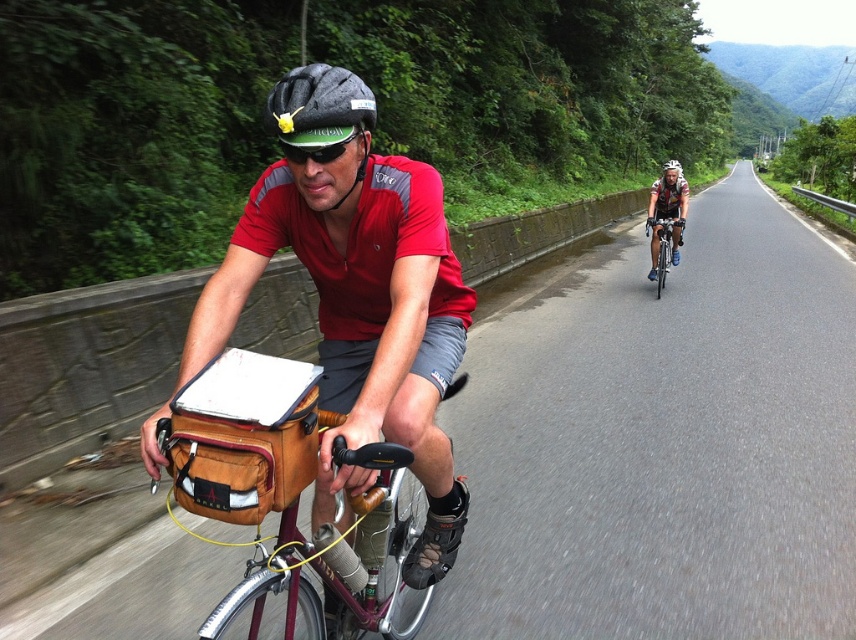
Is asphalt road at center positioned before matte brown bag at center?

That is False.

Which is below, asphalt road at center or matte brown bag at center?

matte brown bag at center is lower down.

Is point (749, 371) behind point (308, 134)?

Yes.

At what (x,y) coordinates should I click in order to perform the action: click on asphalt road at center. Please return your answer as a coordinate pair (x, y). The width and height of the screenshot is (856, 640). Looking at the image, I should click on (664, 444).

Can you confirm if asphalt road at center is smaller than matte black helmet at center?

Incorrect, asphalt road at center is not smaller in size than matte black helmet at center.

Does asphalt road at center come in front of matte black helmet at center?

No.

Is point (525, 524) positioned behind point (354, 93)?

Yes, point (525, 524) is farther from viewer.

Locate an element on the screen. This screenshot has width=856, height=640. asphalt road at center is located at coordinates (x=664, y=444).

Is asphalt road at center closer to the viewer compared to matte black helmet at upper center?

Yes, it is in front of matte black helmet at upper center.

Can you confirm if asphalt road at center is wider than matte black helmet at upper center?

Yes, asphalt road at center is wider than matte black helmet at upper center.

Is point (550, 296) farther from viewer compared to point (652, 273)?

No, it is not.

This screenshot has height=640, width=856. In order to click on asphalt road at center in this screenshot , I will do `click(664, 444)`.